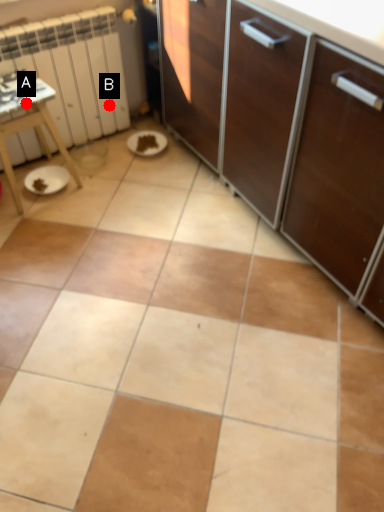
Question: Two points are circled on the image, labeled by A and B beside each circle. Which point is further to the camera?

Choices:
 (A) A is further
 (B) B is further

Answer: (B)